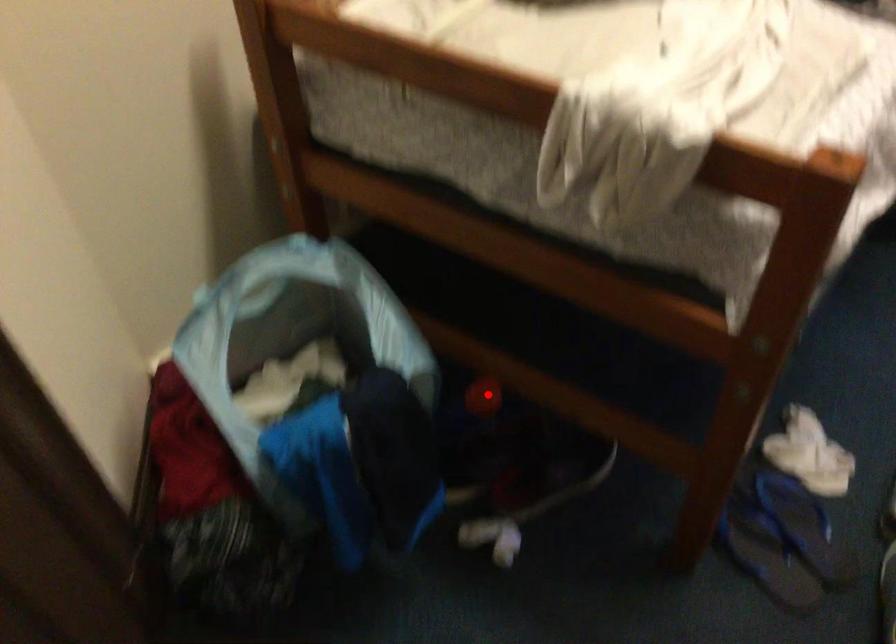
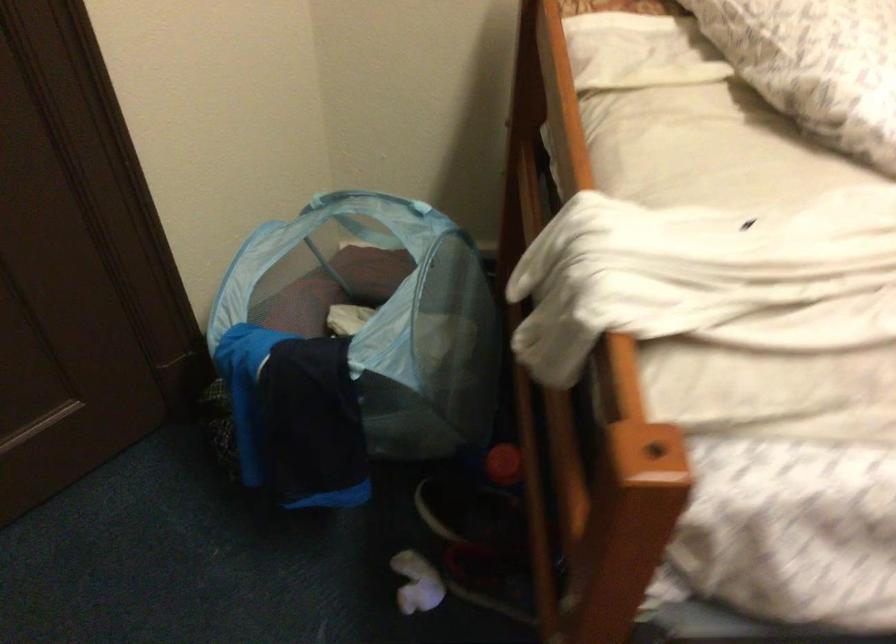
The point at the highlighted location is marked in the first image. Where is the corresponding point in the second image?

(504, 464)